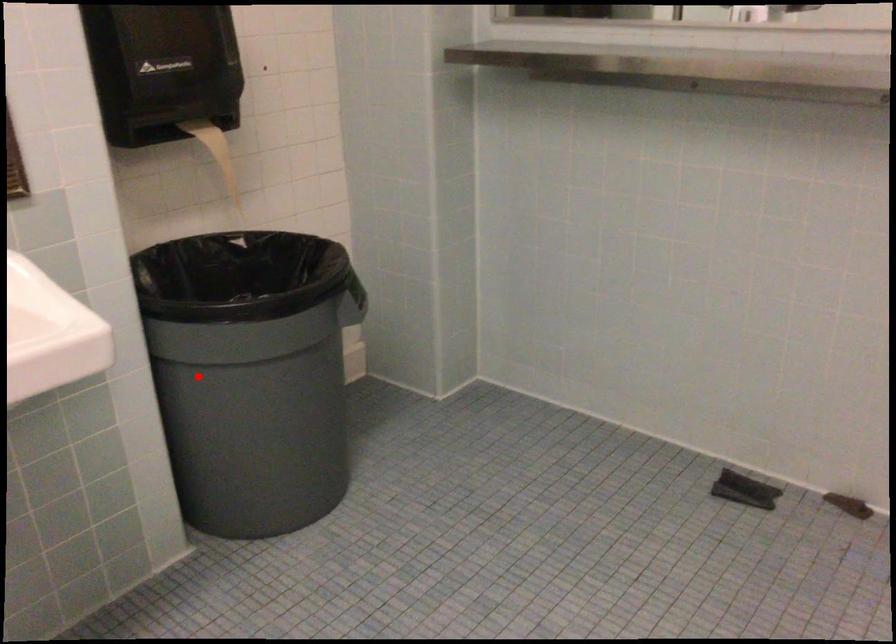
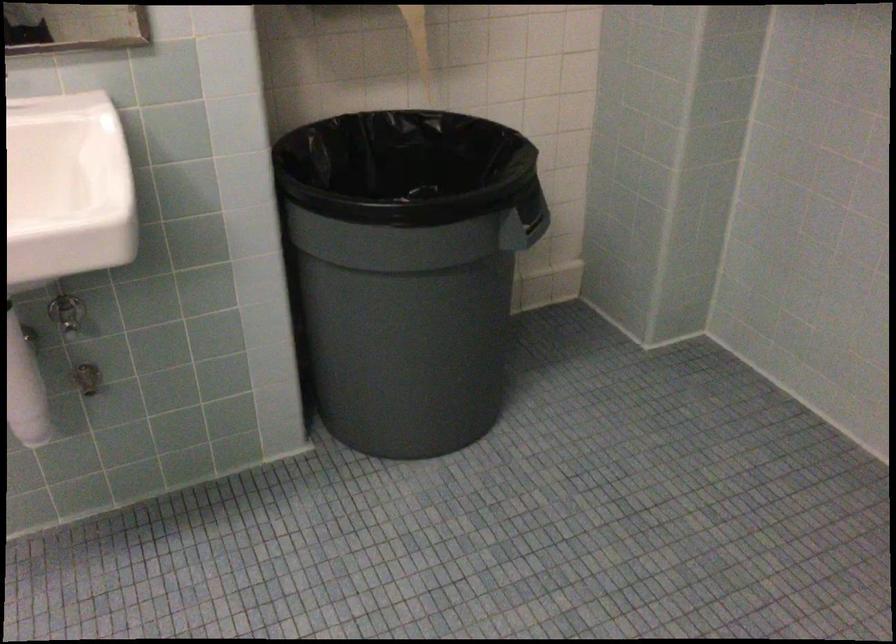
In the second image, find the point that corresponds to the highlighted location in the first image.

(332, 272)